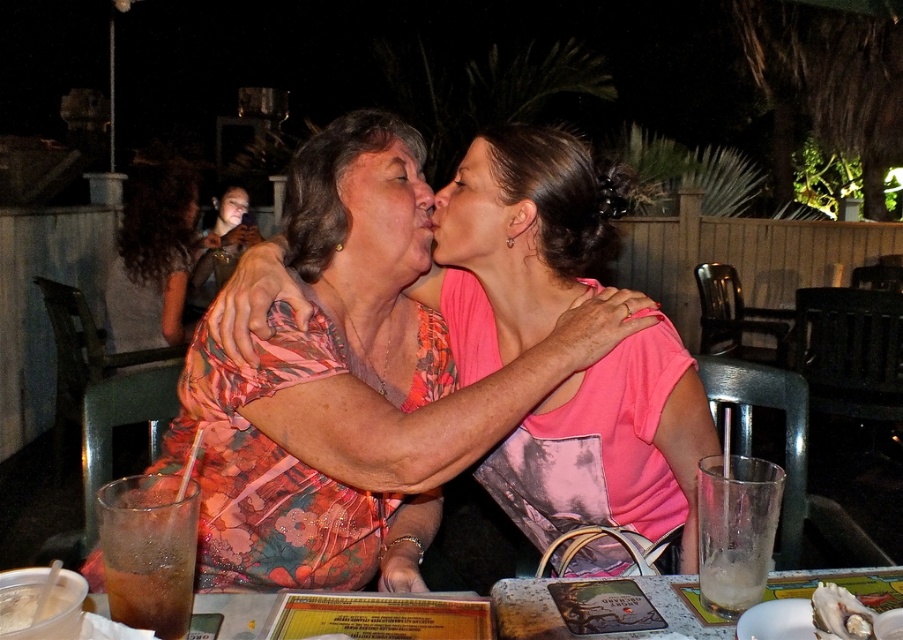
Question: From the image, what is the correct spatial relationship of floral fabric dress at center in relation to pink matte shirt at center?

Choices:
 (A) below
 (B) above

Answer: (A)

Question: Which object is positioned closest to the pink matte shirt at center?

Choices:
 (A) floral fabric dress at center
 (B) matte floral shirt at center
 (C) floral fabric blouse at upper left

Answer: (B)

Question: Does matte floral shirt at center have a greater width compared to pink matte shirt at center?

Choices:
 (A) no
 (B) yes

Answer: (A)

Question: Among these objects, which one is nearest to the camera?

Choices:
 (A) matte floral shirt at center
 (B) smooth skin face at center

Answer: (A)

Question: Which object appears farthest from the camera in this image?

Choices:
 (A) smooth skin face at center
 (B) matte floral shirt at center

Answer: (A)

Question: Can you confirm if pink matte shirt at center is smaller than smooth skin face at center?

Choices:
 (A) no
 (B) yes

Answer: (B)